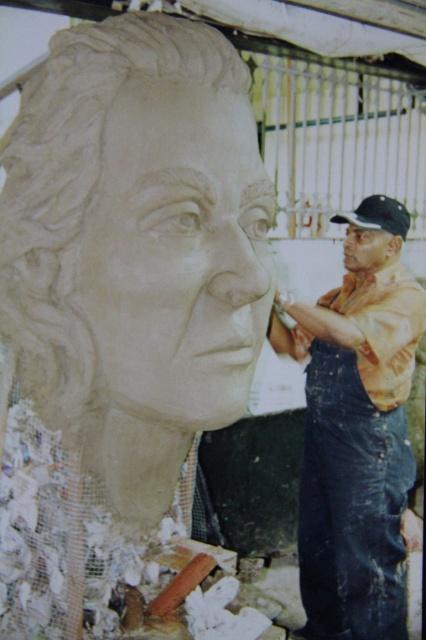
Is clay sculpture at left smaller than denim overalls at right?

Yes, clay sculpture at left is smaller than denim overalls at right.

This screenshot has width=426, height=640. Identify the location of clay sculpture at left. (120, 310).

Who is positioned more to the right, white clay sculpture at center or denim overalls at right?

denim overalls at right

Does point (233, 108) come behind point (399, 476)?

No, it is in front of (399, 476).

Identify the location of white clay sculpture at center. Image resolution: width=426 pixels, height=640 pixels. (178, 252).

Is point (28, 275) closer to viewer compared to point (210, 378)?

Yes.

What do you see at coordinates (120, 310) in the screenshot?
I see `clay sculpture at left` at bounding box center [120, 310].

At what (x,y) coordinates should I click in order to perform the action: click on clay sculpture at left. Please return your answer as a coordinate pair (x, y). Looking at the image, I should click on (120, 310).